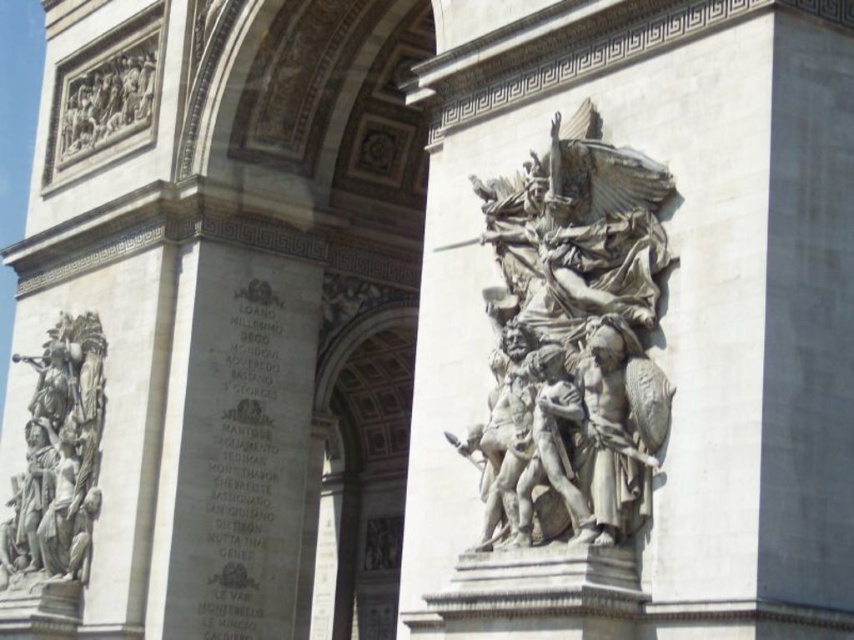
Can you confirm if white stone sculpture at center is shorter than gray stone bas-relief at upper left?

In fact, white stone sculpture at center may be taller than gray stone bas-relief at upper left.

Does white stone sculpture at center have a smaller size compared to gray stone bas-relief at upper left?

Incorrect, white stone sculpture at center is not smaller in size than gray stone bas-relief at upper left.

What do you see at coordinates (664, 314) in the screenshot?
I see `white stone sculpture at center` at bounding box center [664, 314].

The width and height of the screenshot is (854, 640). What are the coordinates of `white stone sculpture at center` in the screenshot? It's located at (664, 314).

Is the position of white stone sculpture at center less distant than that of stone sculpture at center?

Yes, it is.

Looking at this image, can you confirm if white stone sculpture at center is positioned above stone sculpture at center?

Yes, white stone sculpture at center is above stone sculpture at center.

Locate an element on the screen. white stone sculpture at center is located at coordinates (664, 314).

Find the location of a particular element. This screenshot has width=854, height=640. white stone sculpture at center is located at coordinates (664, 314).

Is stone sculpture at center closer to camera compared to stone relief figures at left?

Yes, it is.

Is point (664, 394) in front of point (9, 506)?

That is True.

The width and height of the screenshot is (854, 640). What do you see at coordinates (572, 340) in the screenshot? I see `stone sculpture at center` at bounding box center [572, 340].

Identify the location of stone sculpture at center. (572, 340).